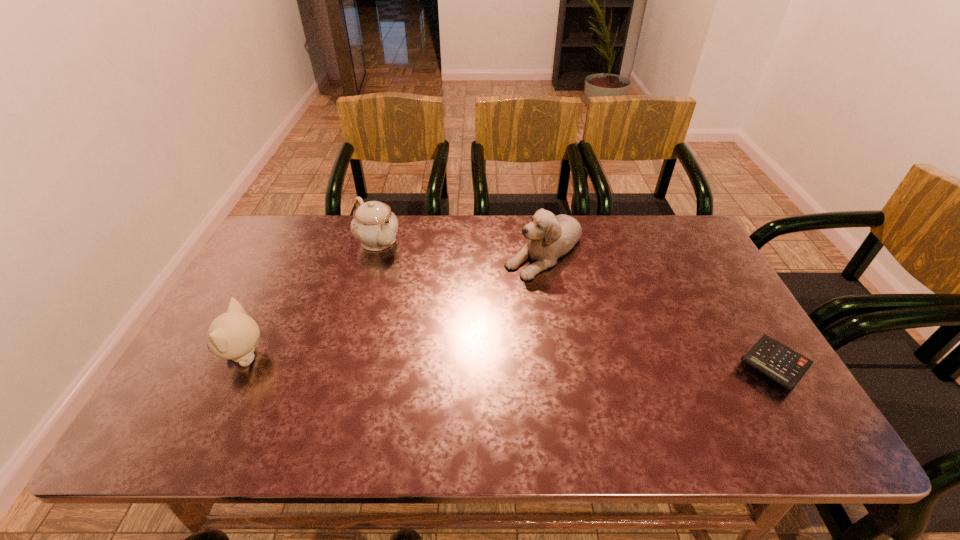
The height and width of the screenshot is (540, 960). What are the coordinates of `unoccupied position between the puppy and the chinaware` in the screenshot? It's located at (461, 245).

What are the coordinates of `vacant point located between the leftmost object and the third object from right to left` in the screenshot? It's located at (311, 298).

Locate an element on the screen. This screenshot has height=540, width=960. free point between the calculator and the puppy is located at coordinates (659, 307).

Find the location of a particular element. The height and width of the screenshot is (540, 960). vacant area between the third object from right to left and the shortest object is located at coordinates (576, 303).

Locate an element on the screen. The height and width of the screenshot is (540, 960). free point between the puppy and the second object from left to right is located at coordinates (461, 245).

Identify the location of free space between the calculator and the chinaware. (576, 303).

You are a GUI agent. You are given a task and a screenshot of the screen. Output one action in this format:
    pyautogui.click(x=<x>, y=<y>)
    Task: Click on the object that is the third closest one to the third object from right to left
    This screenshot has width=960, height=540.
    Given the screenshot: What is the action you would take?
    pyautogui.click(x=785, y=366)

Locate which object ranks third in proximity to the calculator. Please provide its 2D coordinates. Your answer should be formatted as a tuple, i.e. [(x, y)], where the tuple contains the x and y coordinates of a point satisfying the conditions above.

[(233, 335)]

At what (x,y) coordinates should I click in order to perform the action: click on free space that satisfies the following two spatial constraints: 1. on the front side of the calculator; 2. on the left side of the puppy. Please return your answer as a coordinate pair (x, y). Looking at the image, I should click on (564, 366).

Find the location of a particular element. The image size is (960, 540). free space that satisfies the following two spatial constraints: 1. on the front side of the second object from right to left; 2. on the right side of the chinaware is located at coordinates (375, 249).